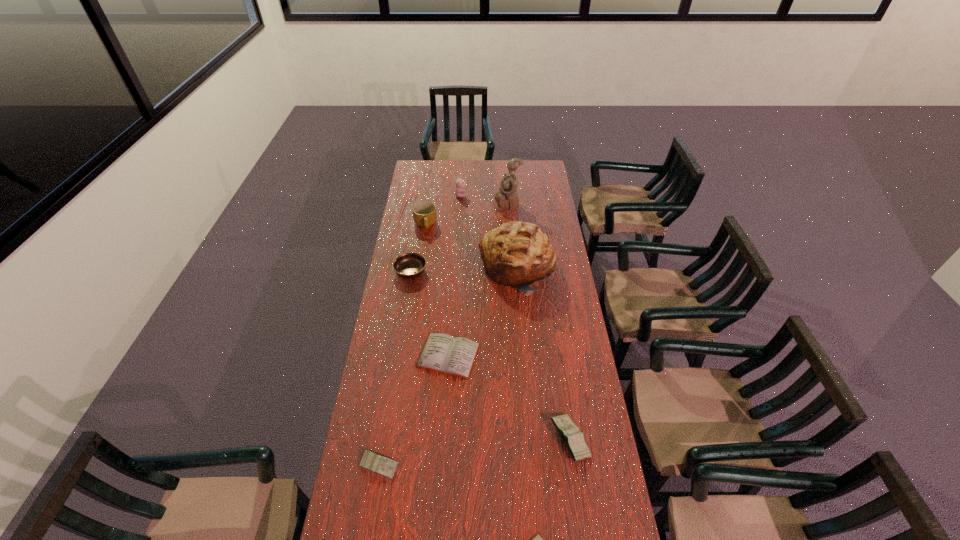
In the image, there is a desktop. Identify the location of blank space at the right edge. The height and width of the screenshot is (540, 960). (540, 187).

Identify the location of blank region between the white figurine and the tallest diary. (539, 321).

At what (x,y) coordinates should I click in order to perform the action: click on free space between the left pink diary and the sixth farthest object. Please return your answer as a coordinate pair (x, y). This screenshot has height=540, width=960. Looking at the image, I should click on (414, 410).

This screenshot has height=540, width=960. What are the coordinates of `vacant space in between the soup bowl and the teddy bear` in the screenshot? It's located at (436, 233).

The image size is (960, 540). What are the coordinates of `free space that is in between the pink teddy bear and the left pink diary` in the screenshot? It's located at (420, 330).

This screenshot has width=960, height=540. Find the location of `free spot between the left pink diary and the fourth nearest object`. free spot between the left pink diary and the fourth nearest object is located at coordinates (414, 410).

Locate an element on the screen. The width and height of the screenshot is (960, 540). vacant region between the left pink diary and the teddy bear is located at coordinates (420, 330).

Where is `free spot between the right pink diary and the third farthest object`? The width and height of the screenshot is (960, 540). free spot between the right pink diary and the third farthest object is located at coordinates (497, 332).

Locate an element on the screen. unoccupied position between the pink teddy bear and the figurine is located at coordinates (484, 199).

Locate which object is the seventh closest to the mug. Please provide its 2D coordinates. Your answer should be formatted as a tuple, i.e. [(x, y)], where the tuple contains the x and y coordinates of a point satisfying the conditions above.

[(375, 462)]